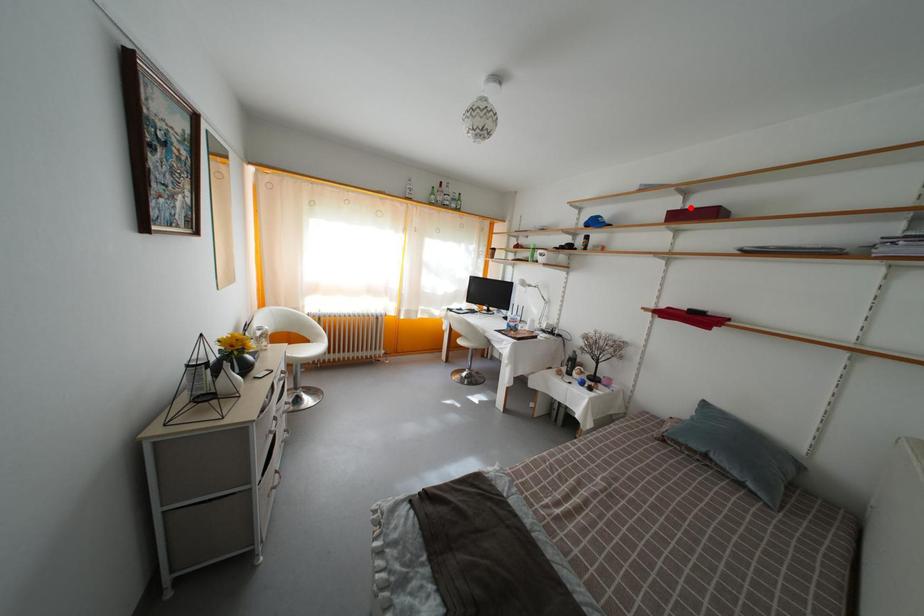
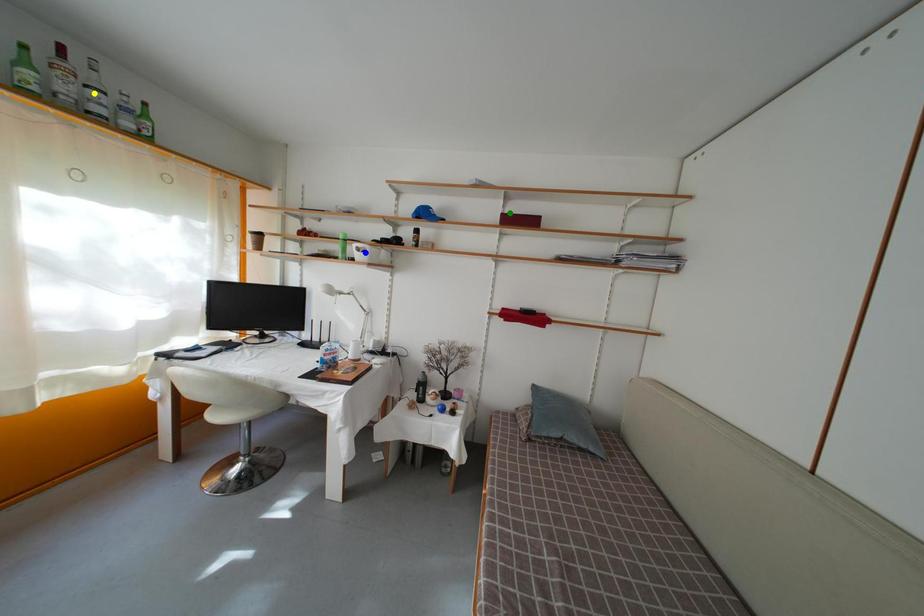
Question: I am providing you with two images of the same scene from different viewpoints. A red point is marked on the first image. You are given multiple points on the second image. In image 2, which mark is for the same physical point as the one in image 1?

Choices:
 (A) blue point
 (B) green point
 (C) yellow point

Answer: (B)